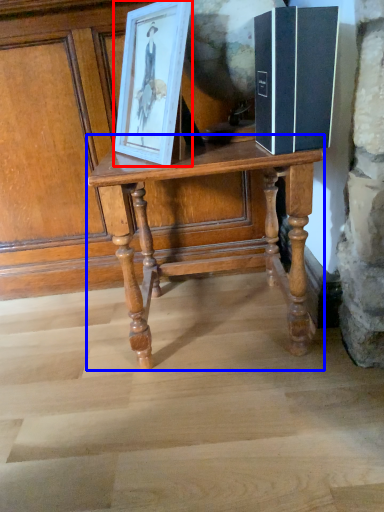
Question: Which point is closer to the camera, picture frame (highlighted by a red box) or table (highlighted by a blue box)?

Choices:
 (A) picture frame
 (B) table

Answer: (A)